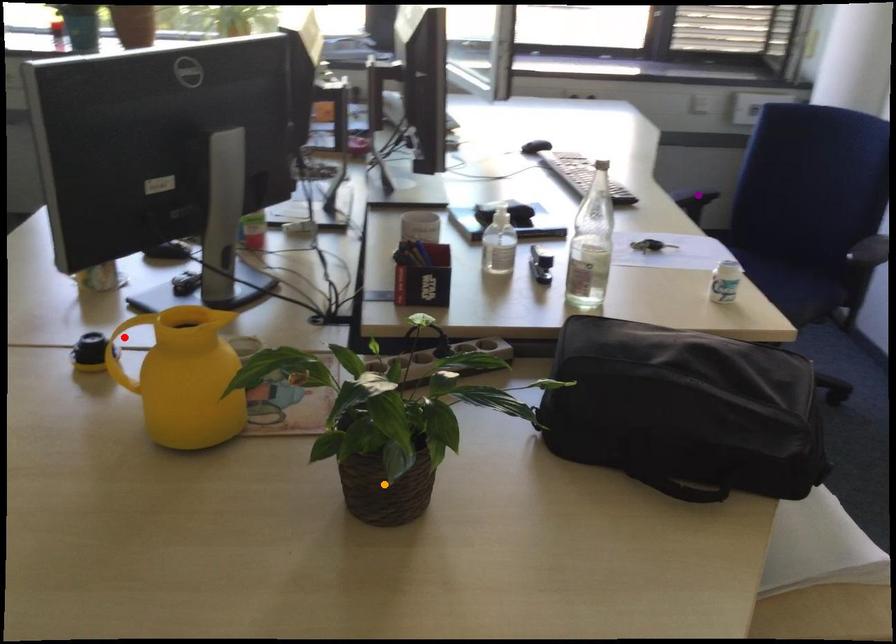
Order these from nearest to farthest:
orange point | red point | purple point

orange point → red point → purple point